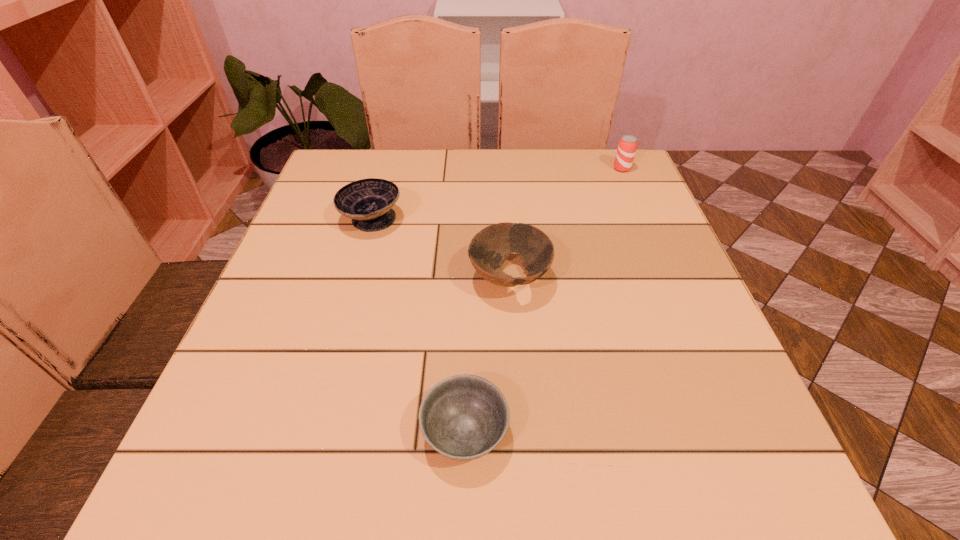
The image size is (960, 540). Find the location of `the rightmost object`. the rightmost object is located at coordinates (627, 145).

At what (x,y) coordinates should I click in order to perform the action: click on beer can. Please return your answer as a coordinate pair (x, y). The width and height of the screenshot is (960, 540). Looking at the image, I should click on (627, 145).

At what (x,y) coordinates should I click in order to perform the action: click on the second nearest object. Please return your answer as a coordinate pair (x, y). The height and width of the screenshot is (540, 960). Looking at the image, I should click on [490, 247].

What are the coordinates of `the leftmost bowl` in the screenshot? It's located at (368, 202).

Where is `the farthest bowl`? the farthest bowl is located at coordinates (368, 202).

You are a GUI agent. You are given a task and a screenshot of the screen. Output one action in this format:
    pyautogui.click(x=<x>, y=<y>)
    Task: Click on the nearest object
    
    Given the screenshot: What is the action you would take?
    pyautogui.click(x=463, y=417)

Locate an element on the screen. the shortest object is located at coordinates (463, 417).

At what (x,y) coordinates should I click in order to perform the action: click on free point located 0.340m on the front of the farthest object. Please return your answer as a coordinate pair (x, y). Looking at the image, I should click on [x=660, y=258].

At what (x,y) coordinates should I click in order to perform the action: click on vacant region located 0.070m on the left of the second nearest object. Please return your answer as a coordinate pair (x, y). Looking at the image, I should click on (435, 279).

This screenshot has height=540, width=960. Find the location of `blank space located on the back of the third nearest object`. blank space located on the back of the third nearest object is located at coordinates (392, 150).